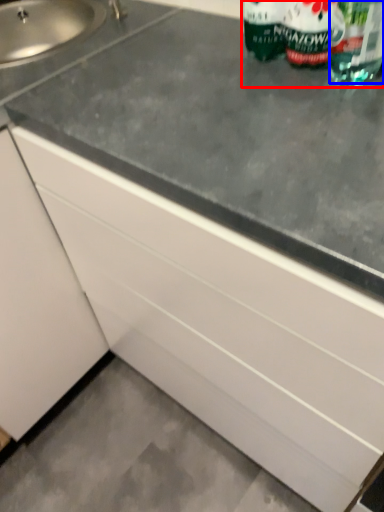
Question: Which of the following is the farthest to the observer, bottle (highlighted by a red box) or drinking straw (highlighted by a blue box)?

Choices:
 (A) bottle
 (B) drinking straw

Answer: (A)